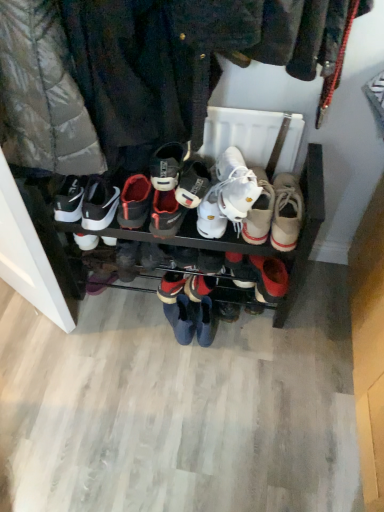
Where is `vacant space situated above beige canvas shoe at center, which appears as the 8th footwear when viewed from the left (from a real-world perspective)`? This screenshot has width=384, height=512. vacant space situated above beige canvas shoe at center, which appears as the 8th footwear when viewed from the left (from a real-world perspective) is located at coordinates (300, 192).